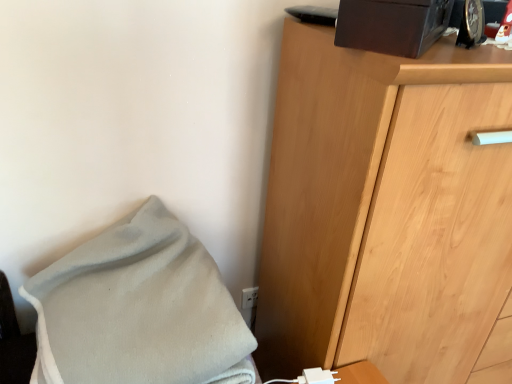
Question: Considering the relative positions of light brown wooden chest of drawers at right and white fleece blanket at lower left in the image provided, is light brown wooden chest of drawers at right to the right of white fleece blanket at lower left from the viewer's perspective?

Choices:
 (A) yes
 (B) no

Answer: (A)

Question: Could you tell me if light brown wooden chest of drawers at right is turned towards white fleece blanket at lower left?

Choices:
 (A) no
 (B) yes

Answer: (A)

Question: Can you confirm if light brown wooden chest of drawers at right is taller than white fleece blanket at lower left?

Choices:
 (A) no
 (B) yes

Answer: (B)

Question: From a real-world perspective, is light brown wooden chest of drawers at right on top of white fleece blanket at lower left?

Choices:
 (A) no
 (B) yes

Answer: (A)

Question: Is light brown wooden chest of drawers at right positioned behind white fleece blanket at lower left?

Choices:
 (A) yes
 (B) no

Answer: (A)

Question: Can you confirm if light brown wooden chest of drawers at right is thinner than white fleece blanket at lower left?

Choices:
 (A) yes
 (B) no

Answer: (A)

Question: Is white fleece blanket at lower left thinner than white plastic electric outlet at lower center?

Choices:
 (A) yes
 (B) no

Answer: (B)

Question: Can you confirm if white fleece blanket at lower left is shorter than white plastic electric outlet at lower center?

Choices:
 (A) yes
 (B) no

Answer: (B)

Question: Is white fleece blanket at lower left taller than white plastic electric outlet at lower center?

Choices:
 (A) yes
 (B) no

Answer: (A)

Question: Is white fleece blanket at lower left positioned with its back to white plastic electric outlet at lower center?

Choices:
 (A) yes
 (B) no

Answer: (B)

Question: Is white plastic electric outlet at lower center completely or partially inside white fleece blanket at lower left?

Choices:
 (A) no
 (B) yes

Answer: (A)

Question: Is white fleece blanket at lower left behind white plastic electric outlet at lower center?

Choices:
 (A) yes
 (B) no

Answer: (B)

Question: Is white fleece blanket at lower left at the back of white plastic electric outlet at lower center?

Choices:
 (A) yes
 (B) no

Answer: (B)